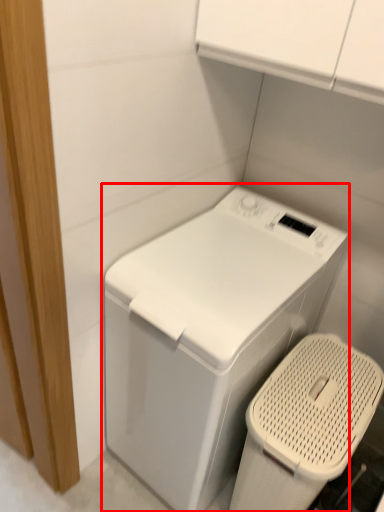
Question: From the image's perspective, where is washing machine (annotated by the red box) located in relation to appliance in the image?

Choices:
 (A) above
 (B) below

Answer: (A)